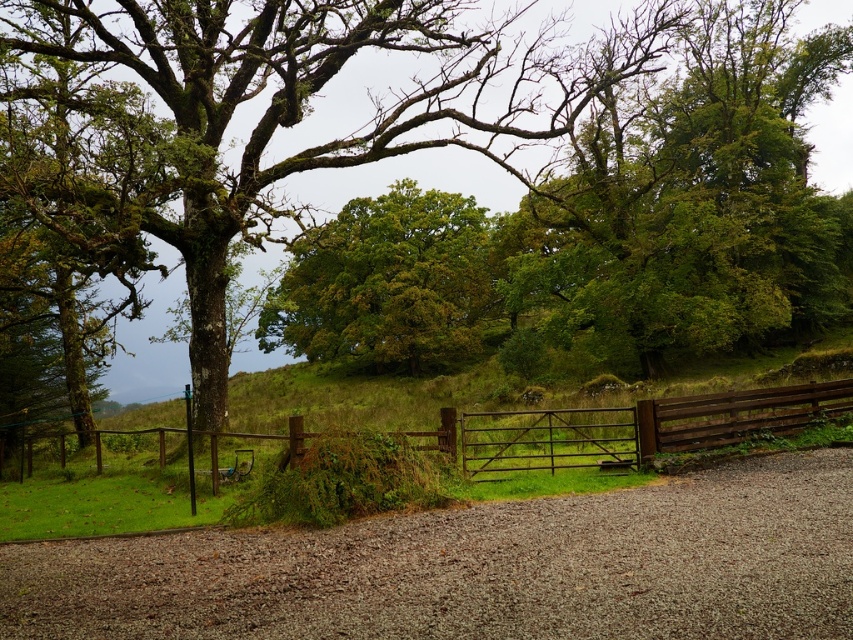
Question: Is the position of gravelly path at center less distant than that of green mossy tree at center?

Choices:
 (A) no
 (B) yes

Answer: (B)

Question: Which of the following is the farthest from the observer?

Choices:
 (A) (526, 436)
 (B) (213, 35)
 (C) (544, 602)
 (D) (357, 285)

Answer: (D)

Question: Which point is farther to the camera?

Choices:
 (A) brown wooden gate at center
 (B) green mossy tree at center
 (C) gravelly path at center
 (D) green leafy tree at center

Answer: (D)

Question: Where is gravelly path at center located in relation to green leafy tree at center in the image?

Choices:
 (A) left
 (B) right

Answer: (B)

Question: Can you confirm if gravelly path at center is positioned to the right of green leafy tree at center?

Choices:
 (A) no
 (B) yes

Answer: (B)

Question: Which of the following is the closest to the observer?

Choices:
 (A) green leafy tree at center
 (B) gravelly path at center

Answer: (B)